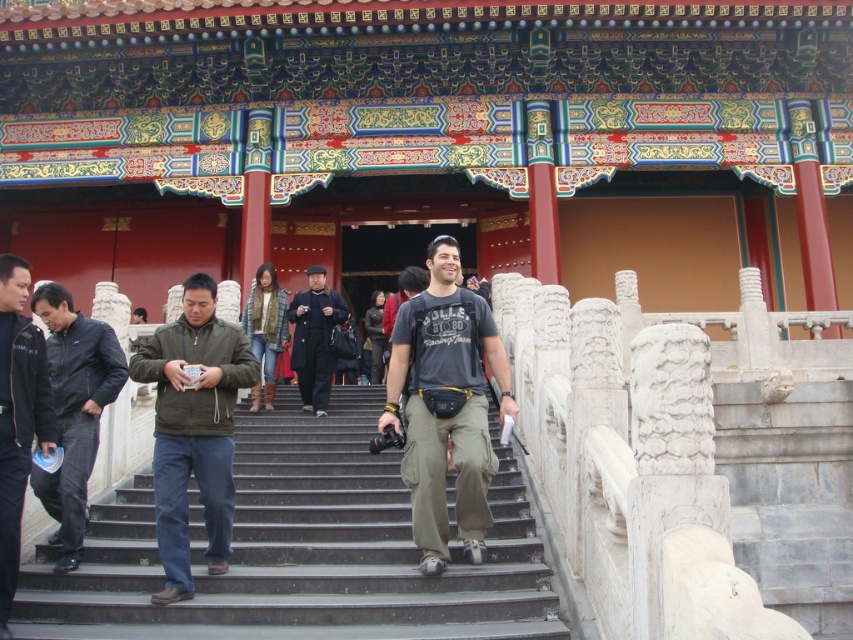
You are a tour guide preparing to lead a group up the stone steps to the entrance. You notice a black leather jacket at lower left and a denim jacket at center. Which jacket is narrower in width?

The black leather jacket at lower left is narrower in width than the denim jacket at center.

You are a visitor standing at the bottom of the stone steps leading to the entrance. You want to place both the dark blue jeans at left and the black leather jacket at lower left on the railing next to you. Which item requires more horizontal space on the railing?

The dark blue jeans at left requires more horizontal space on the railing because its width surpasses that of the black leather jacket at lower left.